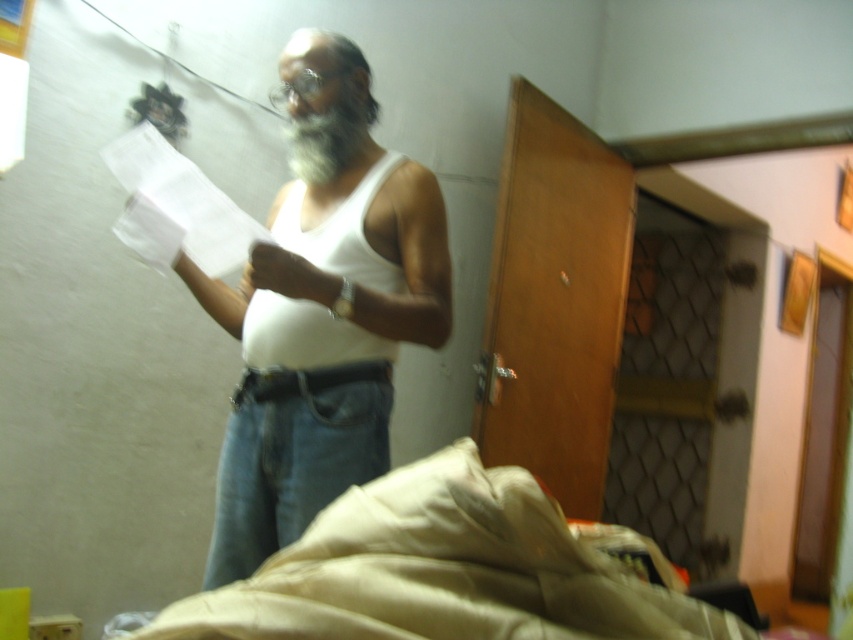
Question: Among these objects, which one is nearest to the camera?

Choices:
 (A) matte white hand at center
 (B) gray/white beard at center
 (C) beige fabric bed at lower center

Answer: (C)

Question: Does white paper at center have a smaller size compared to gray/white beard at center?

Choices:
 (A) yes
 (B) no

Answer: (B)

Question: Which point is closer to the camera?

Choices:
 (A) matte white hand at center
 (B) white paper at center

Answer: (B)

Question: Among these points, which one is nearest to the camera?

Choices:
 (A) (178, 218)
 (B) (305, 42)

Answer: (A)

Question: Can you confirm if white matte tank top at center is positioned below beige fabric bed at lower center?

Choices:
 (A) no
 (B) yes

Answer: (A)

Question: Can you confirm if white matte tank top at center is positioned above beige fabric bed at lower center?

Choices:
 (A) no
 (B) yes

Answer: (B)